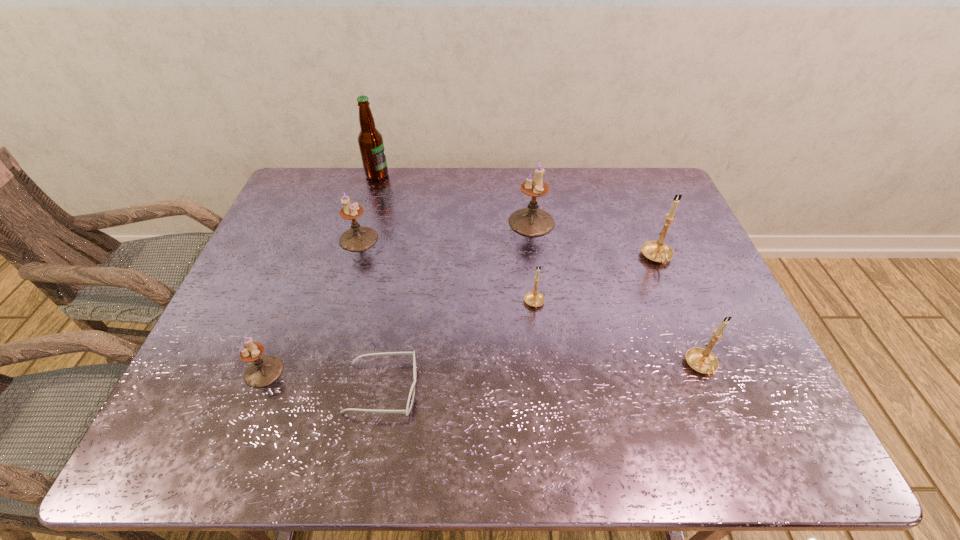
Where is `the leftmost purple candle holder`? the leftmost purple candle holder is located at coordinates (263, 371).

Where is `sunglasses`? sunglasses is located at coordinates (412, 391).

Locate an element on the screen. the fourth object from left to right is located at coordinates (412, 391).

The width and height of the screenshot is (960, 540). Find the location of `vacant space located on the label of the beer bottle`. vacant space located on the label of the beer bottle is located at coordinates (503, 175).

What are the coordinates of `free point located 0.310m on the handle side of the biggest gold candle holder` in the screenshot? It's located at (702, 370).

Locate an element on the screen. vacant space located 0.100m on the back of the biggest purple candle holder is located at coordinates (527, 190).

Identify the location of free space located 0.060m on the right of the second smallest purple candle holder. (397, 239).

This screenshot has height=540, width=960. Find the location of `vacant space positioned on the handle side of the nearest gold candle holder`. vacant space positioned on the handle side of the nearest gold candle holder is located at coordinates [728, 433].

I want to click on free space located on the handle side of the fifth farthest object, so click(548, 423).

The width and height of the screenshot is (960, 540). I want to click on free space located on the right of the smallest purple candle holder, so click(446, 372).